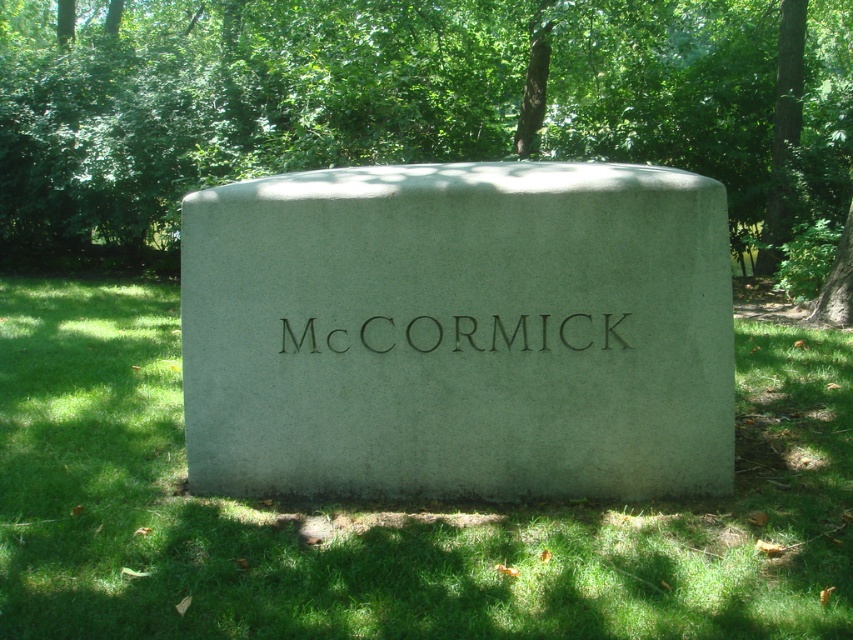
Question: Can you confirm if green leafy tree at center is wider than green grass at center?

Choices:
 (A) yes
 (B) no

Answer: (A)

Question: Which point is closer to the camera?

Choices:
 (A) green grass at center
 (B) gray concrete gravestone at center
 (C) green leafy tree at center

Answer: (A)

Question: Among these points, which one is farthest from the camera?

Choices:
 (A) (233, 387)
 (B) (563, 320)

Answer: (A)

Question: Is gray concrete gravestone at center to the right of blackmaterial/texturetext at center from the viewer's perspective?

Choices:
 (A) no
 (B) yes

Answer: (A)

Question: Which point is closer to the camera taking this photo?

Choices:
 (A) (129, 448)
 (B) (541, 74)

Answer: (A)

Question: Does gray concrete gravestone at center come in front of green leafy tree at center?

Choices:
 (A) yes
 (B) no

Answer: (A)